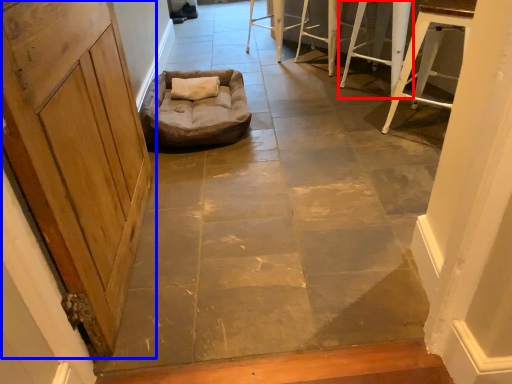
Question: Among these objects, which one is nearest to the camera, furniture (highlighted by a red box) or door (highlighted by a blue box)?

Choices:
 (A) furniture
 (B) door

Answer: (B)